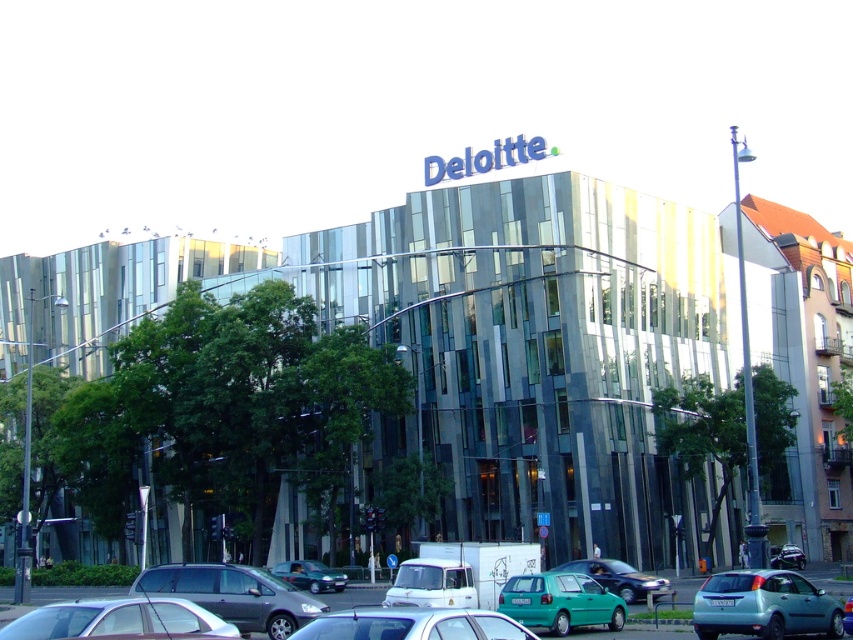
The height and width of the screenshot is (640, 853). What do you see at coordinates (763, 605) in the screenshot?
I see `light blue matte hatchback at lower center` at bounding box center [763, 605].

Who is more distant from viewer, (730, 592) or (543, 621)?

Positioned behind is point (543, 621).

Is point (836, 602) more distant than point (561, 586)?

No, (836, 602) is closer to viewer.

I want to click on light blue matte hatchback at lower center, so click(763, 605).

Can you confirm if silver metallic car at lower left is taller than teal glossy hatchback at center?

Correct, silver metallic car at lower left is much taller as teal glossy hatchback at center.

Consider the image. Does silver metallic car at lower left have a lesser height compared to teal glossy hatchback at center?

In fact, silver metallic car at lower left may be taller than teal glossy hatchback at center.

Who is more forward, (172, 600) or (554, 608)?

Positioned in front is point (172, 600).

Image resolution: width=853 pixels, height=640 pixels. What are the coordinates of `silver metallic car at lower left` in the screenshot? It's located at (119, 620).

Describe the element at coordinates (618, 577) in the screenshot. I see `metallic blue sedan at center` at that location.

Can you confirm if metallic blue sedan at center is positioned to the right of metallic silver car at center?

Incorrect, metallic blue sedan at center is not on the right side of metallic silver car at center.

Is point (614, 570) positioned behind point (775, 560)?

No, it is not.

Where is `metallic blue sedan at center`? This screenshot has height=640, width=853. metallic blue sedan at center is located at coordinates (618, 577).